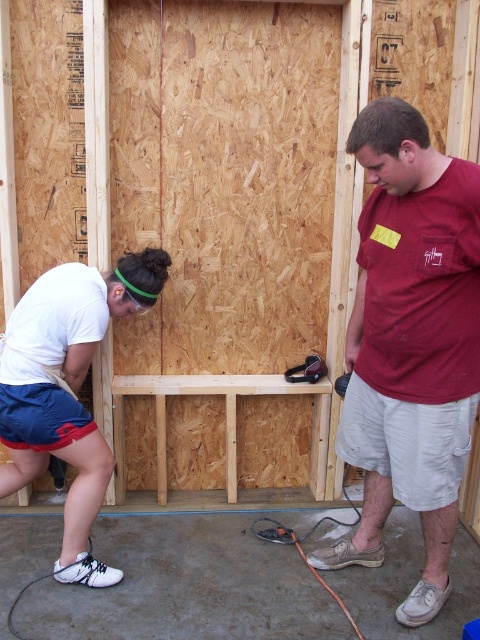
Which is more to the left, maroon t-shirt at center or white matte shirt at lower left?

From the viewer's perspective, white matte shirt at lower left appears more on the left side.

Between maroon t-shirt at center and white matte shirt at lower left, which one has less height?

With less height is white matte shirt at lower left.

Between point (448, 493) and point (22, 438), which one is positioned behind?

The point (22, 438) is behind.

Where is `maroon t-shirt at center`? This screenshot has height=640, width=480. maroon t-shirt at center is located at coordinates (410, 342).